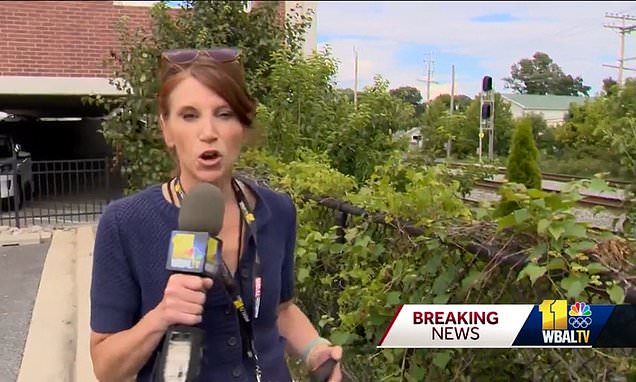
The height and width of the screenshot is (382, 636). I want to click on mic, so click(184, 212).